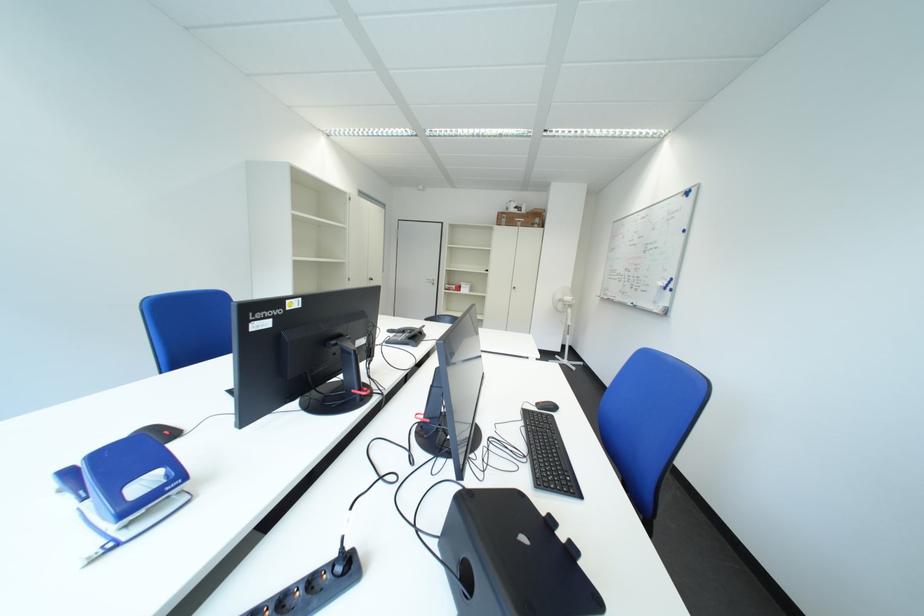
Find where to lift the black phone handset. Please return your answer as a coordinate pair (x, y).

(407, 333)